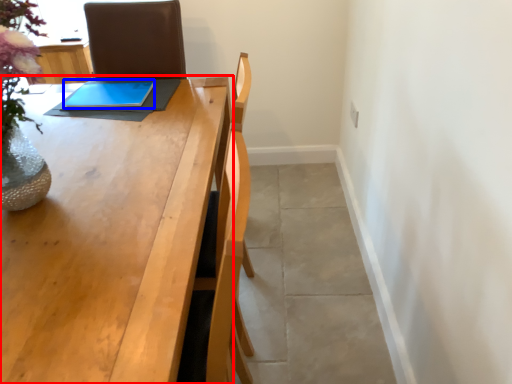
Question: Which of the following is the closest to the observer, table (highlighted by a red box) or tablet computer (highlighted by a blue box)?

Choices:
 (A) table
 (B) tablet computer

Answer: (A)